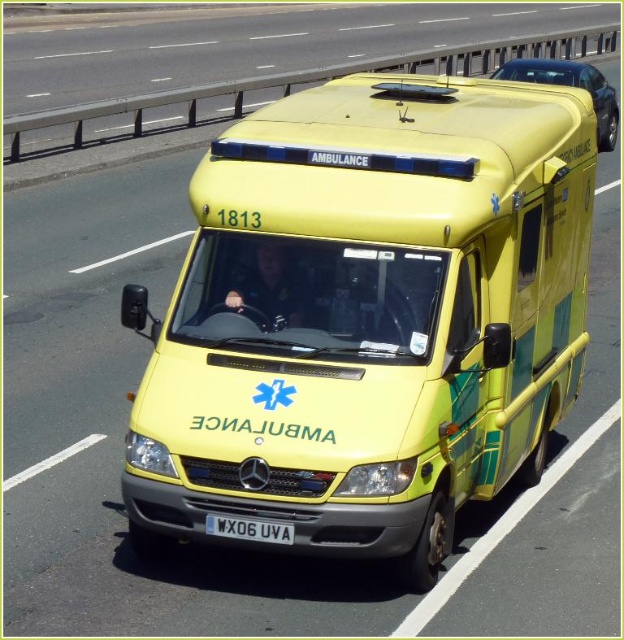
Question: Can you confirm if yellow matte ambulance at upper center is wider than white plastic license plate at center?

Choices:
 (A) no
 (B) yes

Answer: (B)

Question: Among these points, which one is nearest to the camera?

Choices:
 (A) (328, 497)
 (B) (230, 529)

Answer: (A)

Question: Where is yellow matte ambulance at center located in relation to white plastic license plate at center in the image?

Choices:
 (A) below
 (B) above

Answer: (B)

Question: Which of the following is the farthest from the observer?

Choices:
 (A) (250, 525)
 (B) (565, 81)
 (C) (557, 288)

Answer: (B)

Question: Which point is farther to the camera?

Choices:
 (A) (605, 148)
 (B) (416, 83)

Answer: (A)

Question: Does yellow matte ambulance at center appear on the right side of white plastic license plate at center?

Choices:
 (A) no
 (B) yes

Answer: (B)